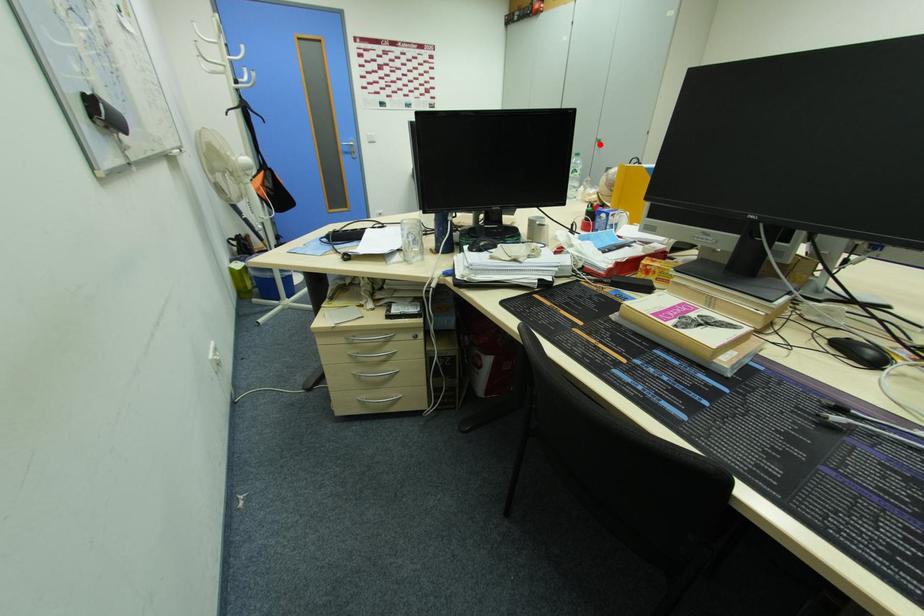
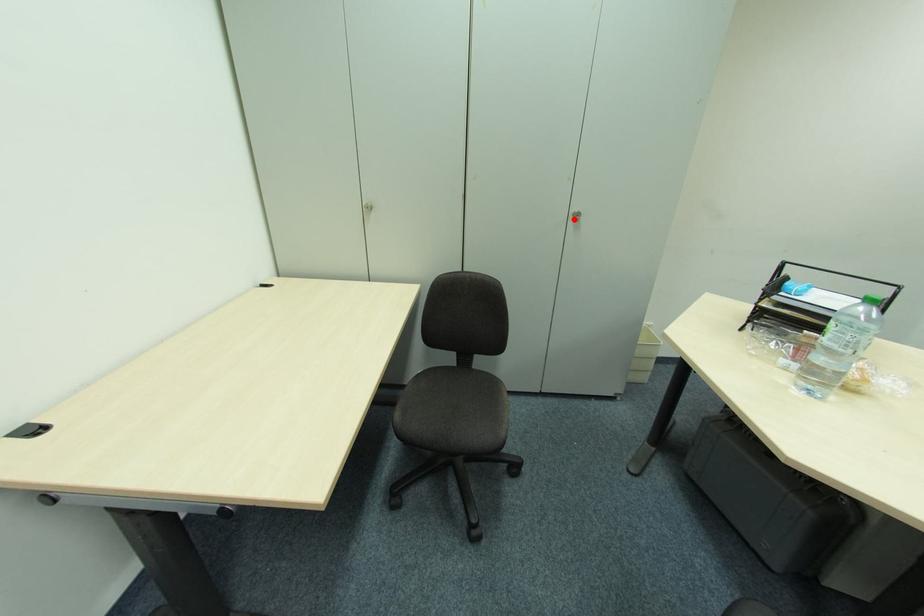
I am providing you with two images of the same scene from different viewpoints. A red point is marked on the first image and another point is marked on the second image. Do the highlighted points in image1 and image2 indicate the same real-world spot?

Yes